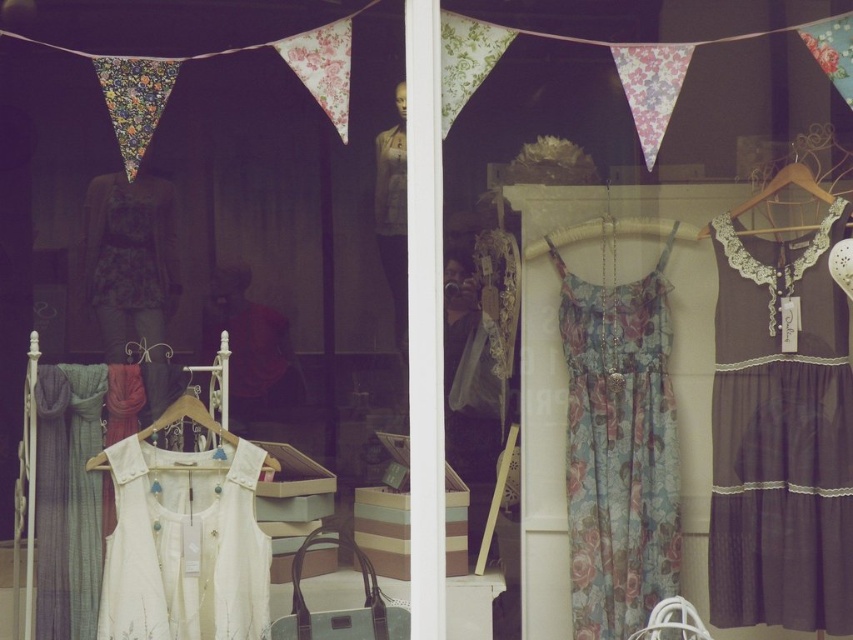
Which is in front, point (183, 483) or point (831, 200)?

Point (183, 483)

Is white cotton vest at lower left smaller than wooden hanger at upper right?

Yes.

Is point (242, 444) in front of point (784, 173)?

That is True.

Find the location of a particular element. Image resolution: width=853 pixels, height=640 pixels. white cotton vest at lower left is located at coordinates (184, 545).

Does dark gray lace dress at right appear over white fabric hanger at center?

Indeed, dark gray lace dress at right is positioned over white fabric hanger at center.

Who is positioned more to the left, dark gray lace dress at right or white fabric hanger at center?

white fabric hanger at center

The height and width of the screenshot is (640, 853). Find the location of `dark gray lace dress at right`. dark gray lace dress at right is located at coordinates (780, 433).

Consider the image. Does floral chiffon dress at center come in front of matte white dress at center?

Yes, it is in front of matte white dress at center.

Can you confirm if floral chiffon dress at center is smaller than matte white dress at center?

Yes.

Is point (585, 605) less distant than point (251, 371)?

Yes, point (585, 605) is in front of point (251, 371).

The height and width of the screenshot is (640, 853). I want to click on floral chiffon dress at center, so click(x=619, y=449).